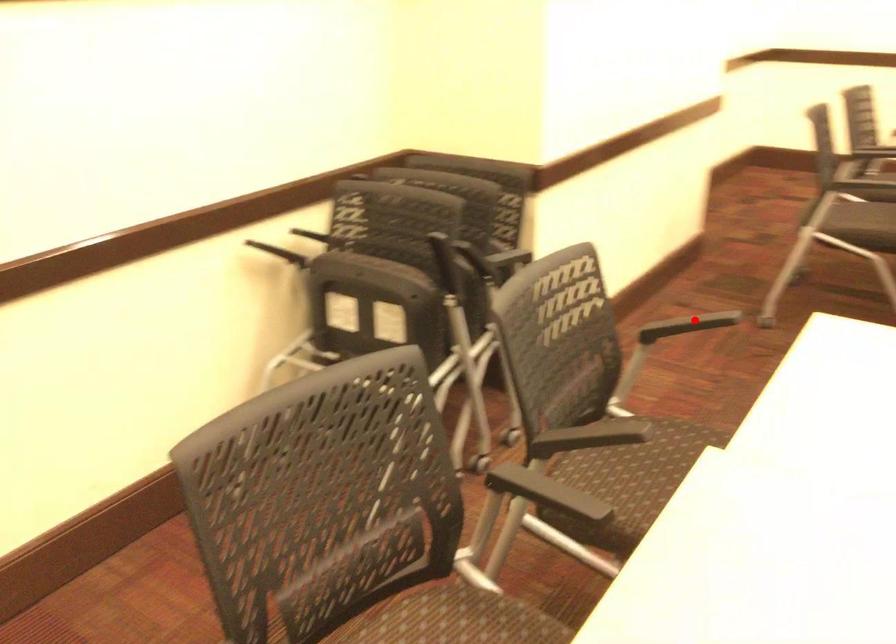
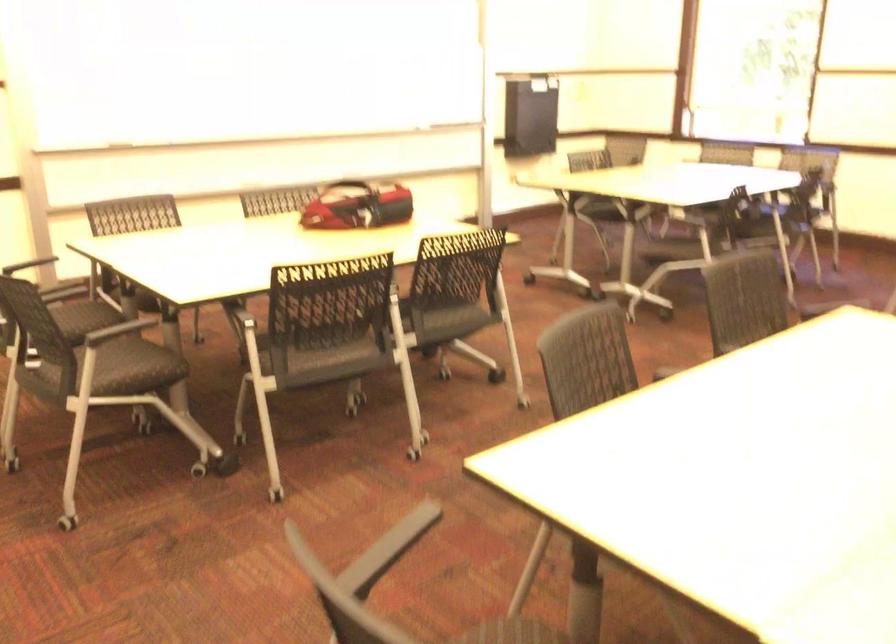
Question: A red point is marked in image1. In image2, is the corresponding 3D point closer to the camera or farther? Reply with the corresponding letter.

Choices:
 (A) The corresponding 3D point is closer.
 (B) The corresponding 3D point is farther.

Answer: (A)